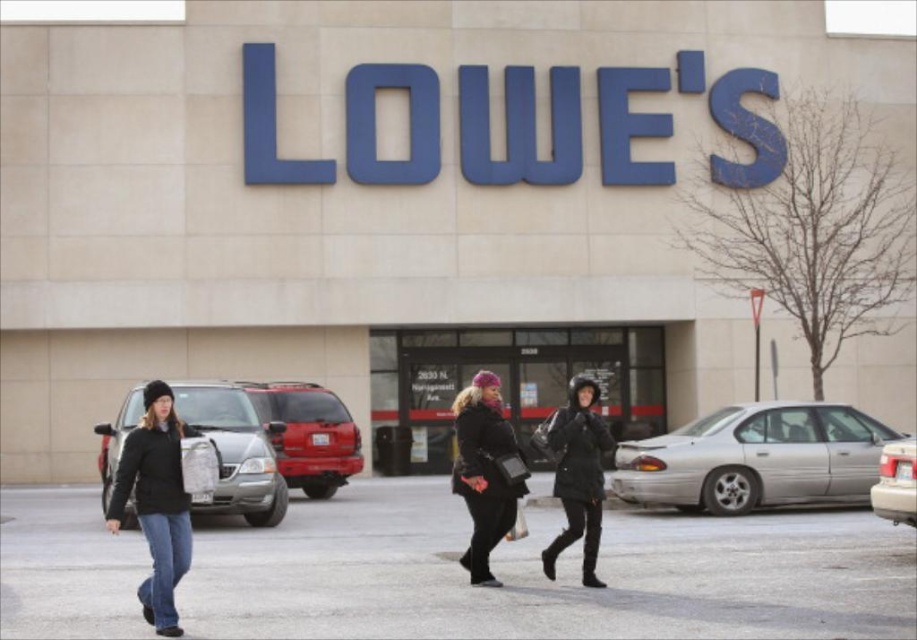
Question: Which point is closer to the camera?

Choices:
 (A) velvet black coat at center
 (B) black matte jacket at left
 (C) silver metallic sedan at lower right

Answer: (B)

Question: Is the position of silver metallic sedan at right more distant than that of black puffy coat at center?

Choices:
 (A) no
 (B) yes

Answer: (B)

Question: Does black matte jacket at left have a greater width compared to matte red suv at center?

Choices:
 (A) yes
 (B) no

Answer: (B)

Question: Among these objects, which one is nearest to the camera?

Choices:
 (A) velvet black coat at center
 (B) matte red suv at center
 (C) silver metallic sedan at right
 (D) matte silver van at left

Answer: (A)

Question: Is silver metallic sedan at right behind black matte jacket at left?

Choices:
 (A) yes
 (B) no

Answer: (A)

Question: Which of the following is the farthest from the observer?

Choices:
 (A) silver metallic sedan at right
 (B) silver metallic sedan at lower right
 (C) black puffy coat at center
 (D) velvet black coat at center

Answer: (A)